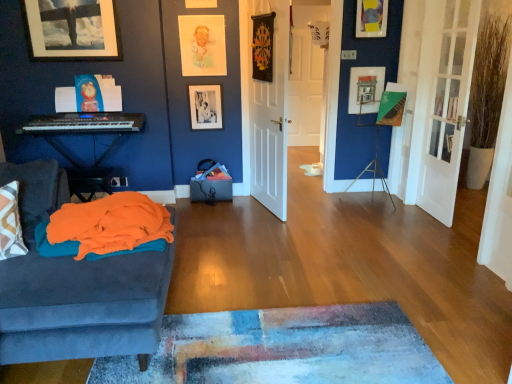
Question: Is white matte door at center, arranged as the 3th door when viewed from the right, further to camera compared to pastel paper portrait at upper center, which is counted as the third picture frame, starting from the right?

Choices:
 (A) yes
 (B) no

Answer: (B)

Question: From the image's perspective, is white matte door at center, which ranks as the 2th door in front-to-back order, on top of pastel paper portrait at upper center, the 3th picture frame from the left?

Choices:
 (A) no
 (B) yes

Answer: (A)

Question: From a real-world perspective, is white matte door at center, arranged as the 3th door when viewed from the right, under pastel paper portrait at upper center, the 3th picture frame from the left?

Choices:
 (A) no
 (B) yes

Answer: (B)

Question: Does white matte door at center, arranged as the 3th door when viewed from the right, have a lesser width compared to pastel paper portrait at upper center, which is counted as the third picture frame, starting from the right?

Choices:
 (A) no
 (B) yes

Answer: (A)

Question: Is white matte door at center, arranged as the 3th door when viewed from the right, bigger than pastel paper portrait at upper center, which is counted as the third picture frame, starting from the right?

Choices:
 (A) yes
 (B) no

Answer: (A)

Question: From a real-world perspective, relative to matte black keyboard at left, is white wooden door at center, the first door viewed from the back, vertically above or below?

Choices:
 (A) above
 (B) below

Answer: (A)

Question: From the image's perspective, relative to matte black keyboard at left, is white wooden door at center, the 2th door viewed from the left, above or below?

Choices:
 (A) above
 (B) below

Answer: (A)

Question: Is white wooden door at center, the 2th door viewed from the left, wider or thinner than matte black keyboard at left?

Choices:
 (A) thin
 (B) wide

Answer: (A)

Question: Considering the positions of white wooden door at center, the first door viewed from the back, and matte black keyboard at left in the image, is white wooden door at center, the first door viewed from the back, bigger or smaller than matte black keyboard at left?

Choices:
 (A) small
 (B) big

Answer: (B)

Question: Is point (202, 365) closer or farther from the camera than point (95, 175)?

Choices:
 (A) farther
 (B) closer

Answer: (B)

Question: From the image's perspective, relative to orange fabric at left, is textured wool rug at lower center above or below?

Choices:
 (A) below
 (B) above

Answer: (A)

Question: Looking at their shapes, would you say textured wool rug at lower center is wider or thinner than orange fabric at left?

Choices:
 (A) wide
 (B) thin

Answer: (A)

Question: From a real-world perspective, is textured wool rug at lower center above or below orange fabric at left?

Choices:
 (A) above
 (B) below

Answer: (B)

Question: Considering the positions of matte black keyboard at left and white matte door at center, arranged as the 3th door when viewed from the right, in the image, is matte black keyboard at left taller or shorter than white matte door at center, arranged as the 3th door when viewed from the right,?

Choices:
 (A) short
 (B) tall

Answer: (A)

Question: Is matte black keyboard at left inside the boundaries of white matte door at center, which ranks as the 2th door in front-to-back order, or outside?

Choices:
 (A) inside
 (B) outside

Answer: (B)